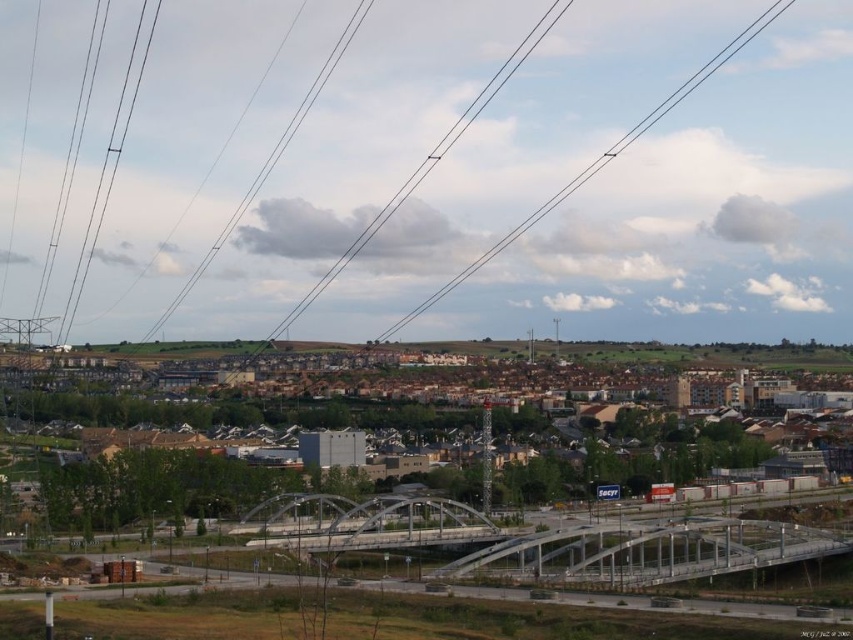
What are the coordinates of `black wire at upper center` in the screenshot? It's located at (438, 168).

Can you confirm if black wire at upper center is wider than metallic gray bridge at center?

Correct, the width of black wire at upper center exceeds that of metallic gray bridge at center.

Does point (579, 141) come behind point (274, 525)?

Yes, point (579, 141) is farther from viewer.

Where is `black wire at upper center`? black wire at upper center is located at coordinates (438, 168).

Is black wire at upper center in front of brown brick buildings at center?

No, black wire at upper center is further to the viewer.

Between black wire at upper center and brown brick buildings at center, which one has more height?

With more height is black wire at upper center.

The height and width of the screenshot is (640, 853). What are the coordinates of `black wire at upper center` in the screenshot? It's located at (438, 168).

This screenshot has width=853, height=640. Identify the location of black wire at upper center. pos(438,168).

Which of these two, brown brick buildings at center or metallic gray bridge at center, stands shorter?

With less height is metallic gray bridge at center.

Can you confirm if brown brick buildings at center is shorter than metallic gray bridge at center?

No, brown brick buildings at center is not shorter than metallic gray bridge at center.

The width and height of the screenshot is (853, 640). Describe the element at coordinates (408, 417) in the screenshot. I see `brown brick buildings at center` at that location.

Where is `brown brick buildings at center`? This screenshot has width=853, height=640. brown brick buildings at center is located at coordinates (408, 417).